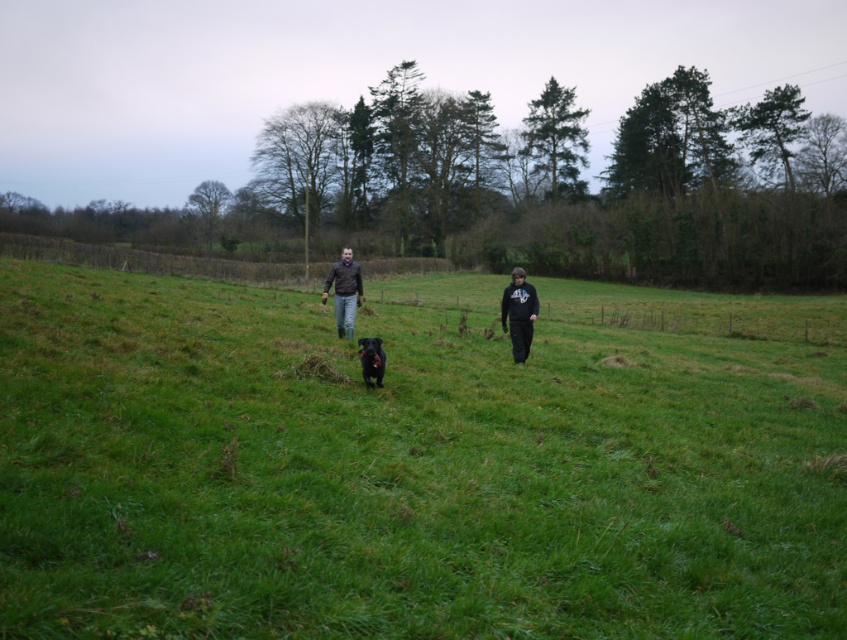
Question: Is black matte sweatshirt at center thinner than brown leather jacket at center?

Choices:
 (A) no
 (B) yes

Answer: (B)

Question: Which object is positioned farthest from the green grass at center?

Choices:
 (A) black matte sweatshirt at center
 (B) brown leather jacket at center

Answer: (B)

Question: From the image, what is the correct spatial relationship of black matte sweatshirt at center in relation to black furry dog at center?

Choices:
 (A) below
 (B) above

Answer: (B)

Question: Estimate the real-world distances between objects in this image. Which object is farther from the black matte sweatshirt at center?

Choices:
 (A) brown leather jacket at center
 (B) green grass at center

Answer: (B)

Question: Which point is closer to the camera?

Choices:
 (A) click(342, 276)
 (B) click(529, 316)
 (C) click(363, 372)
 (D) click(713, 502)

Answer: (D)

Question: Observing the image, what is the correct spatial positioning of green grass at center in reference to black matte sweatshirt at center?

Choices:
 (A) below
 (B) above

Answer: (A)